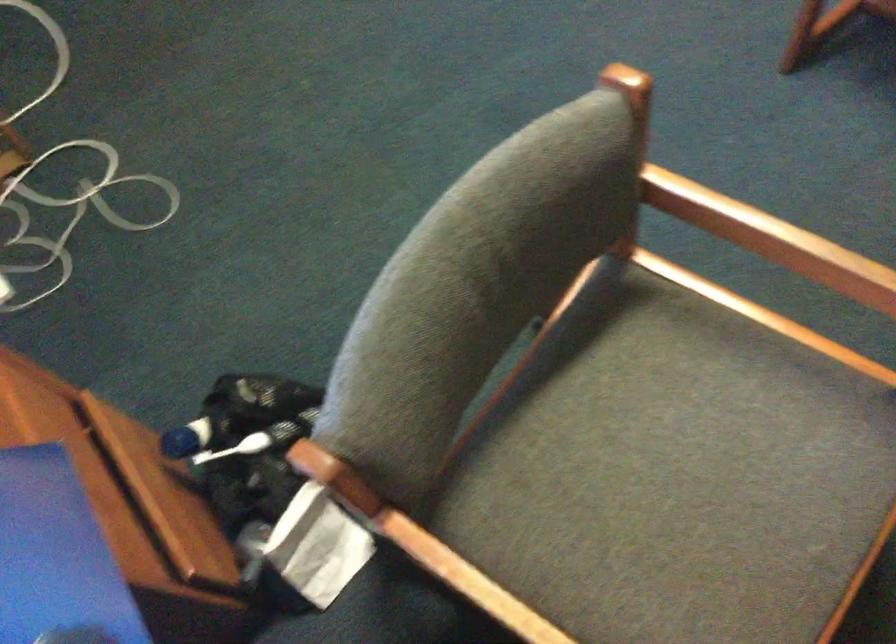
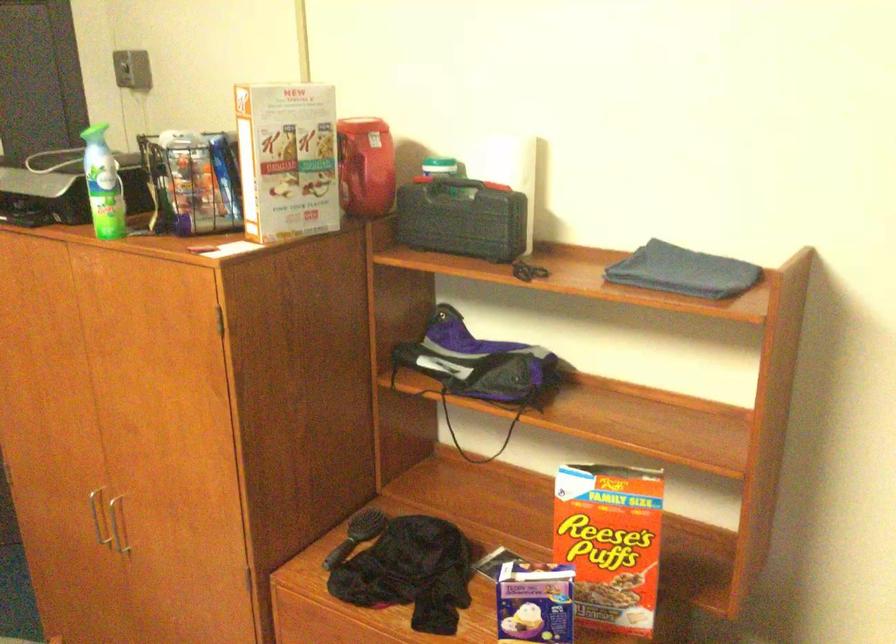
Question: The camera is either moving clockwise (left) or counter-clockwise (right) around the object. The first image is from the beginning of the video and the second image is from the end. Is the camera moving left or right when shooting the video?

Choices:
 (A) Left
 (B) Right

Answer: (A)